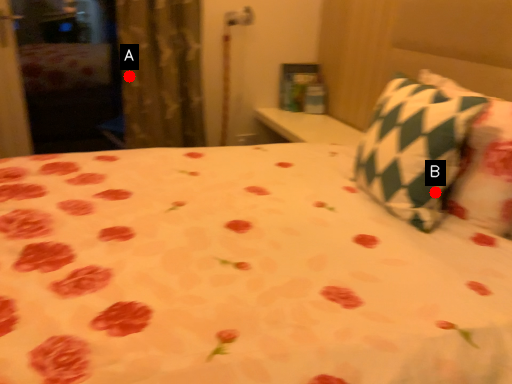
Question: Two points are circled on the image, labeled by A and B beside each circle. Which point is farther to the camera?

Choices:
 (A) A is further
 (B) B is further

Answer: (A)